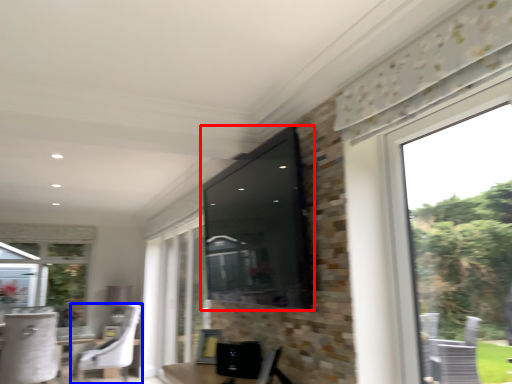
Question: Which of the following is the farthest to the observer, window screen (highlighted by a red box) or chair (highlighted by a blue box)?

Choices:
 (A) window screen
 (B) chair

Answer: (B)